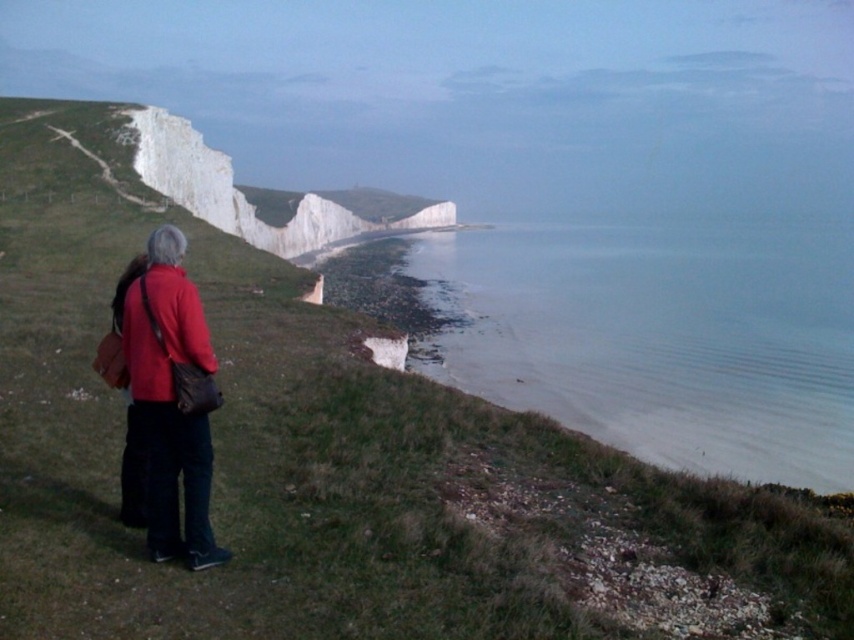
Does clear water at lower right appear on the right side of matte red coat at lower left?

Indeed, clear water at lower right is positioned on the right side of matte red coat at lower left.

Can you confirm if clear water at lower right is positioned to the left of matte red coat at lower left?

Incorrect, clear water at lower right is not on the left side of matte red coat at lower left.

What do you see at coordinates (657, 337) in the screenshot?
I see `clear water at lower right` at bounding box center [657, 337].

The height and width of the screenshot is (640, 854). What are the coordinates of `clear water at lower right` in the screenshot? It's located at (657, 337).

Who is positioned more to the left, matte red jacket at lower left or matte red coat at lower left?

Positioned to the left is matte red coat at lower left.

Between point (126, 324) and point (144, 298), which one is positioned behind?

The point (126, 324) is more distant.

You are a GUI agent. You are given a task and a screenshot of the screen. Output one action in this format:
    pyautogui.click(x=<x>, y=<y>)
    Task: Click on the matte red jacket at lower left
    The image size is (854, 640).
    Given the screenshot: What is the action you would take?
    coord(171,401)

Find the location of a particular element. clear water at lower right is located at coordinates (657, 337).

Is clear water at lower right above matte red jacket at lower left?

Yes.

Is point (831, 292) closer to camera compared to point (192, 477)?

No, (831, 292) is behind (192, 477).

Identify the location of clear water at lower right. coord(657,337).